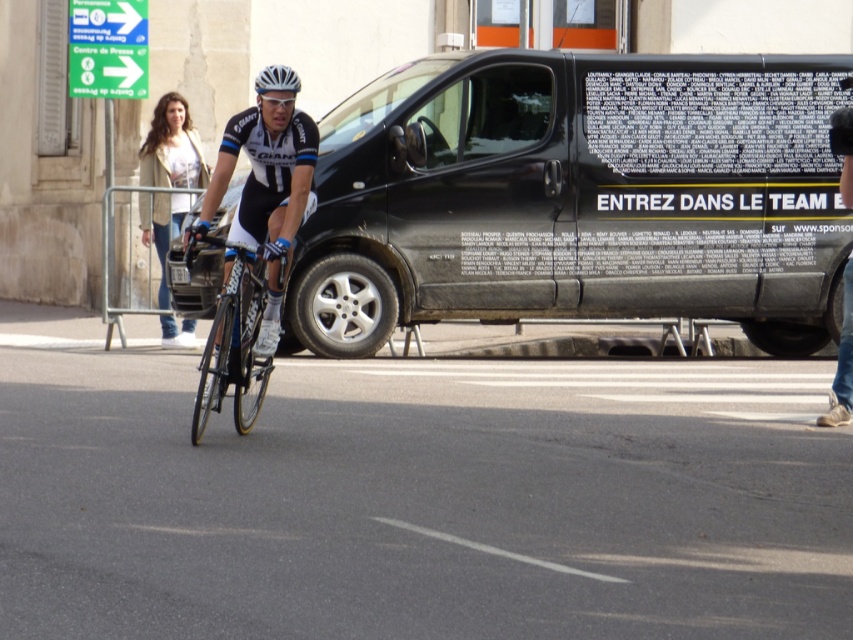
Between point (257, 317) and point (260, 93), which one is positioned in front?

Point (260, 93) is more forward.

Who is more distant from viewer, (259, 250) or (267, 83)?

The point (259, 250) is behind.

Where is `shiny blue frame at center`? shiny blue frame at center is located at coordinates (233, 339).

Who is more forward, (294, 179) or (271, 67)?

Point (271, 67) is more forward.

Can you confirm if black matte cycling jersey at center is positioned below white matte bicycle helmet at center?

Yes, black matte cycling jersey at center is below white matte bicycle helmet at center.

Between point (247, 234) and point (276, 70), which one is positioned in front?

Point (276, 70) is in front.

Locate an element on the screen. Image resolution: width=853 pixels, height=640 pixels. black matte cycling jersey at center is located at coordinates (265, 189).

Who is more distant from viewer, (206,177) or (283,90)?

The point (206,177) is behind.

Describe the element at coordinates (172, 147) in the screenshot. This screenshot has height=640, width=853. I see `denim jacket at left` at that location.

The image size is (853, 640). Find the location of `denim jacket at left`. denim jacket at left is located at coordinates (172, 147).